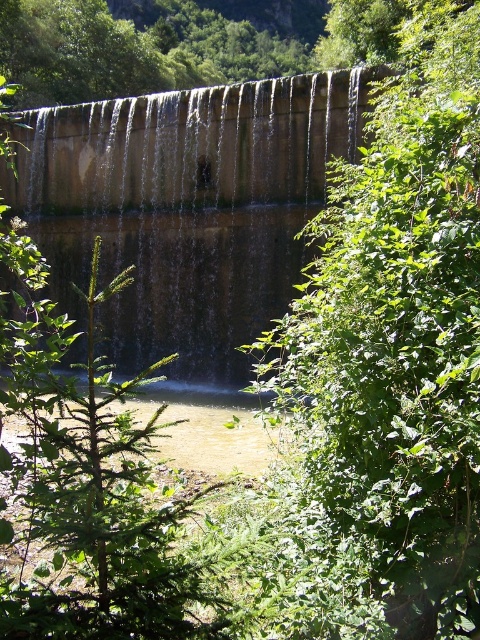
From the picture: Does green leafy tree at center appear on the right side of brown concrete dam at center?

Yes, green leafy tree at center is to the right of brown concrete dam at center.

Between point (412, 460) and point (302, 99), which one is positioned behind?

Positioned behind is point (302, 99).

Find the location of a particular element. The height and width of the screenshot is (640, 480). green leafy tree at center is located at coordinates (393, 352).